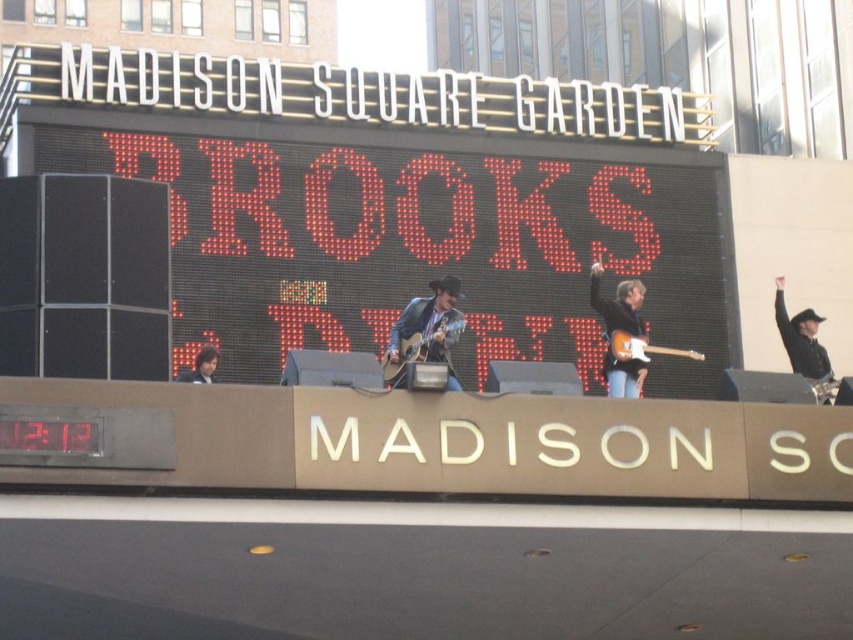
Question: Based on their relative distances, which object is nearer to the wooden electric guitar at center?

Choices:
 (A) black leather hat at upper right
 (B) red led sign at center
 (C) matte brown acoustic guitar at center
 (D) glossy wood guitar at right

Answer: (D)

Question: Can you confirm if red led sign at center is thinner than black leather hat at upper right?

Choices:
 (A) no
 (B) yes

Answer: (A)

Question: Which object is closer to the camera taking this photo?

Choices:
 (A) matte brown acoustic guitar at center
 (B) black leather hat at upper right
 (C) glossy wood guitar at right
 (D) red led sign at center

Answer: (C)

Question: Does glossy wood guitar at right lie in front of matte brown acoustic guitar at center?

Choices:
 (A) yes
 (B) no

Answer: (A)

Question: In this image, where is glossy wood guitar at right located relative to wooden electric guitar at center?

Choices:
 (A) right
 (B) left

Answer: (B)

Question: Among these points, which one is farthest from the camera?

Choices:
 (A) (631, 227)
 (B) (453, 314)
 (C) (625, 324)

Answer: (A)